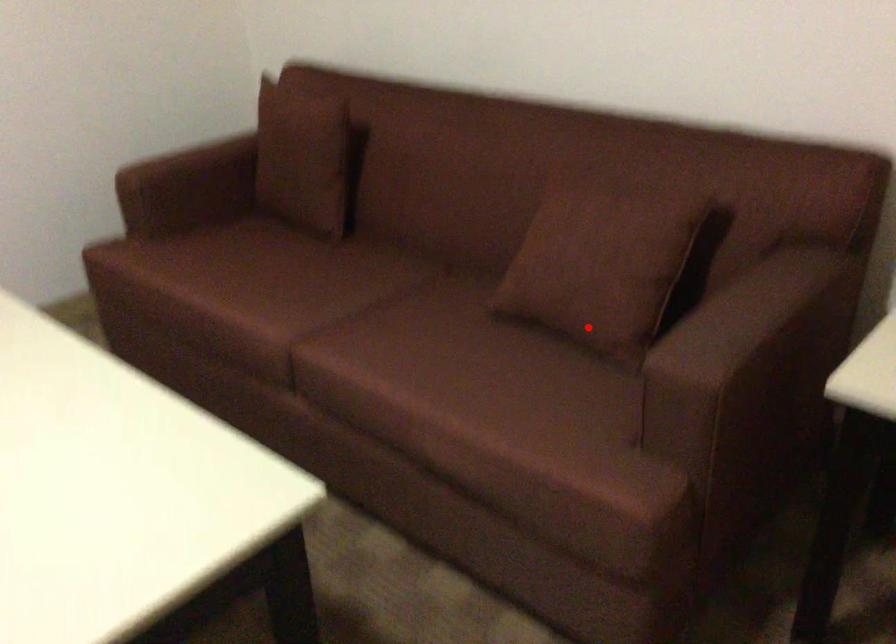
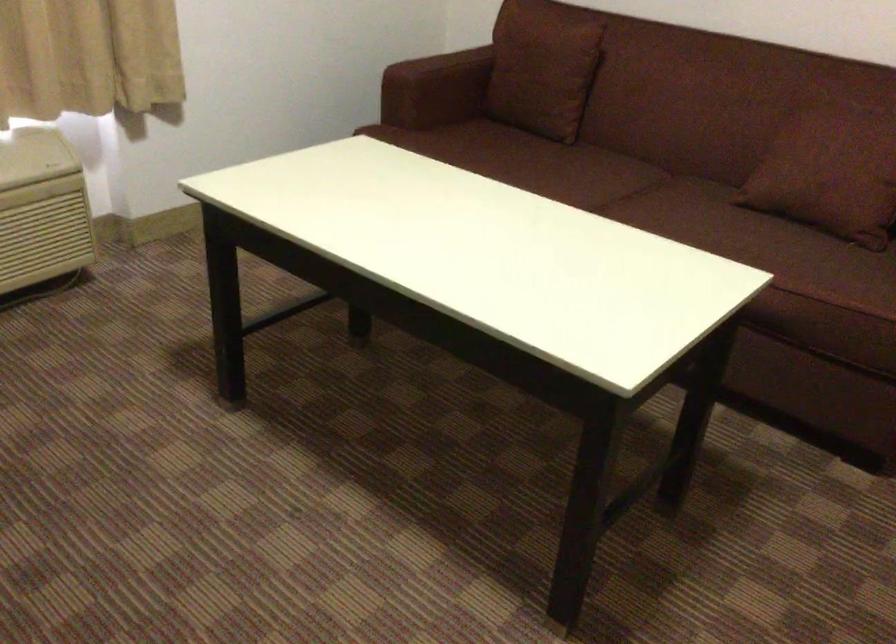
Question: A red point is marked in image1. In image2, is the corresponding 3D point closer to the camera or farther? Reply with the corresponding letter.

Choices:
 (A) The corresponding 3D point is closer.
 (B) The corresponding 3D point is farther.

Answer: (B)